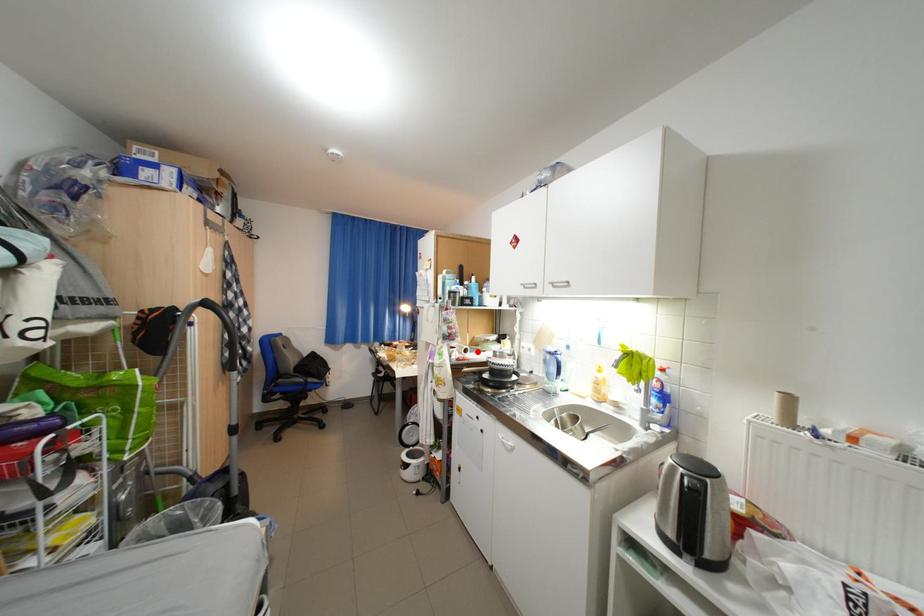
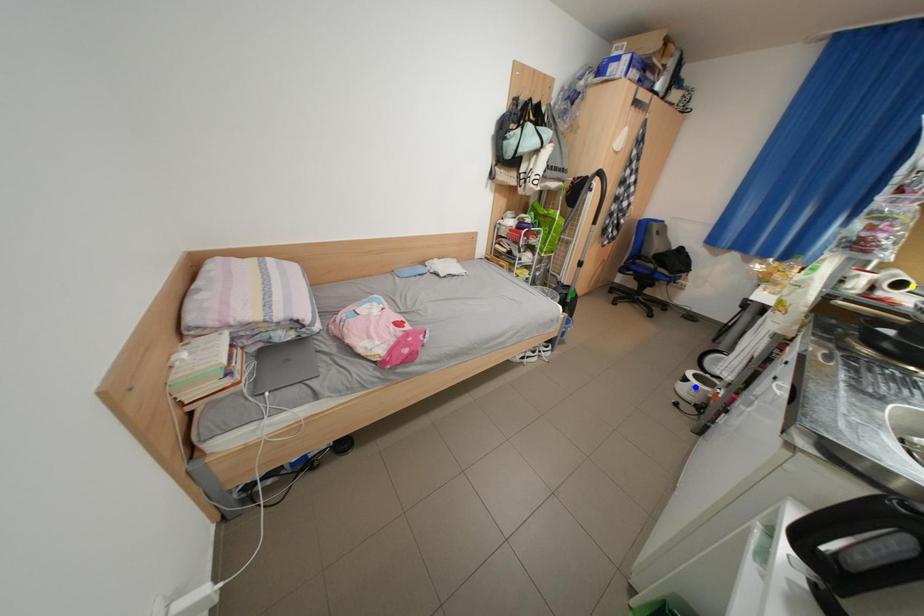
Question: I am providing you with two images of the same scene from different viewpoints. A red point is marked on the first image. You are given multiple points on the second image. Which spot in image 2 lines up with the point in image 1?

Choices:
 (A) yellow point
 (B) blue point
 (C) green point

Answer: (A)